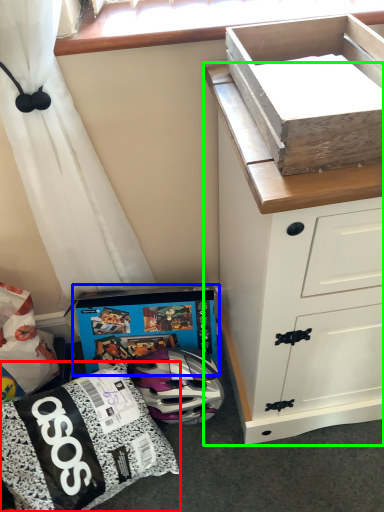
Question: Considering the real-world distances, which object is closest to kit (highlighted by a red box)? cardboard box (highlighted by a blue box) or chest of drawers (highlighted by a green box).

Choices:
 (A) cardboard box
 (B) chest of drawers

Answer: (A)